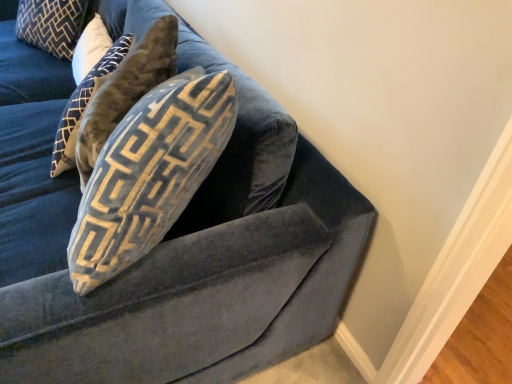
Question: Is velvet blue pillow at upper left, the 1th pillow positioned from the front, far away from velvet couch at upper right?

Choices:
 (A) no
 (B) yes

Answer: (A)

Question: Is velvet blue pillow at upper left, marked as the 2th pillow in a left-to-right arrangement, not within velvet couch at upper right?

Choices:
 (A) yes
 (B) no

Answer: (B)

Question: Is velvet blue pillow at upper left, acting as the first pillow starting from the right, placed right next to velvet couch at upper right?

Choices:
 (A) yes
 (B) no

Answer: (B)

Question: Is velvet blue pillow at upper left, acting as the first pillow starting from the right, wider than velvet couch at upper right?

Choices:
 (A) yes
 (B) no

Answer: (B)

Question: Can you confirm if velvet blue pillow at upper left, marked as the 2th pillow in a left-to-right arrangement, is taller than velvet couch at upper right?

Choices:
 (A) yes
 (B) no

Answer: (B)

Question: Is velvet blue pillow at upper left, acting as the first pillow starting from the right, oriented towards velvet couch at upper right?

Choices:
 (A) yes
 (B) no

Answer: (A)

Question: Does velvet couch at upper right turn towards velvet blue pillow at upper left, marked as the 2th pillow in a left-to-right arrangement?

Choices:
 (A) no
 (B) yes

Answer: (B)

Question: Can you confirm if velvet couch at upper right is positioned to the right of velvet blue pillow at upper left, acting as the 2th pillow starting from the back?

Choices:
 (A) yes
 (B) no

Answer: (B)

Question: Would you say velvet couch at upper right contains velvet blue pillow at upper left, acting as the first pillow starting from the right?

Choices:
 (A) yes
 (B) no

Answer: (A)

Question: Can you see velvet couch at upper right touching velvet blue pillow at upper left, the 1th pillow positioned from the front?

Choices:
 (A) yes
 (B) no

Answer: (B)

Question: Is the depth of velvet couch at upper right greater than that of velvet blue pillow at upper left, which is the first pillow from bottom to top?

Choices:
 (A) yes
 (B) no

Answer: (B)

Question: Can you confirm if velvet couch at upper right is thinner than velvet blue pillow at upper left, which is the first pillow from bottom to top?

Choices:
 (A) yes
 (B) no

Answer: (B)

Question: Is velvet blue pillow at upper left, which is the 1th pillow from left to right, bigger than velvet couch at upper right?

Choices:
 (A) yes
 (B) no

Answer: (B)